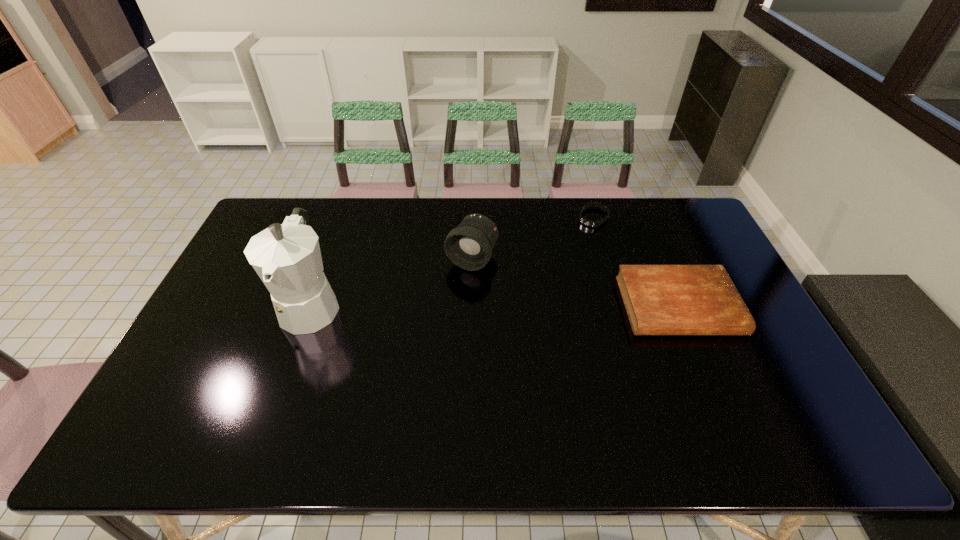
Identify the location of vacant space on the desktop that is between the coffeepot and the Bible and is positioned on the display of the farthest object. This screenshot has width=960, height=540. (521, 305).

You are a GUI agent. You are given a task and a screenshot of the screen. Output one action in this format:
    pyautogui.click(x=<x>, y=<y>)
    Task: Click on the vacant space on the desktop that is between the tallest object and the Bible and is positioned at the front element of the third object from right to left
    This screenshot has width=960, height=540.
    Given the screenshot: What is the action you would take?
    pyautogui.click(x=444, y=305)